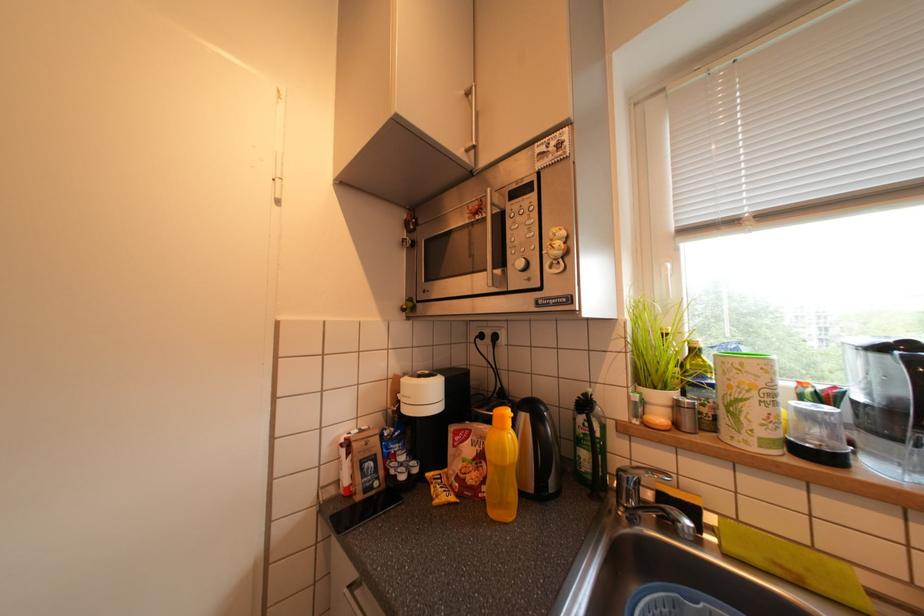
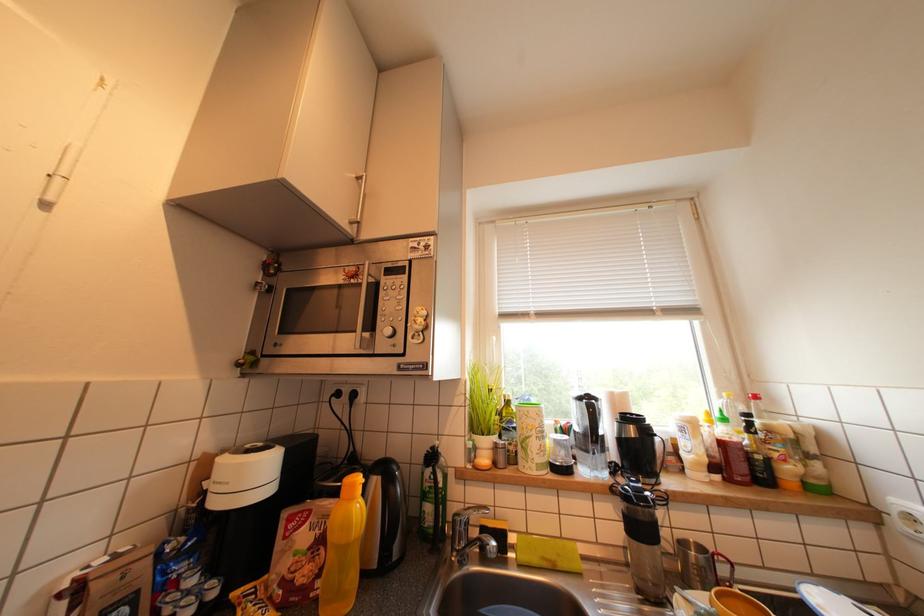
Question: How did the camera likely rotate?

Choices:
 (A) Left
 (B) Right
 (C) Up
 (D) Down

Answer: (B)